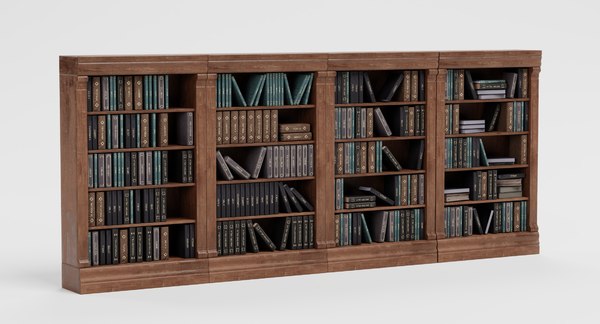
This screenshot has width=600, height=324. Find the location of `top of book shelve`. top of book shelve is located at coordinates (115, 64), (250, 64), (359, 63), (472, 59).